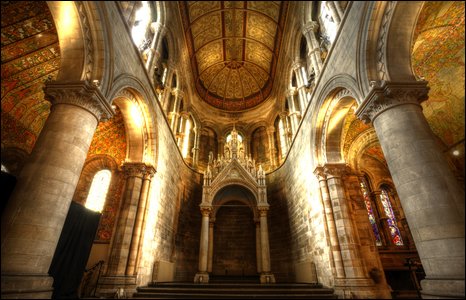
Where is `columns`? The image size is (466, 300). columns is located at coordinates (428, 166), (37, 216), (135, 213), (345, 226).